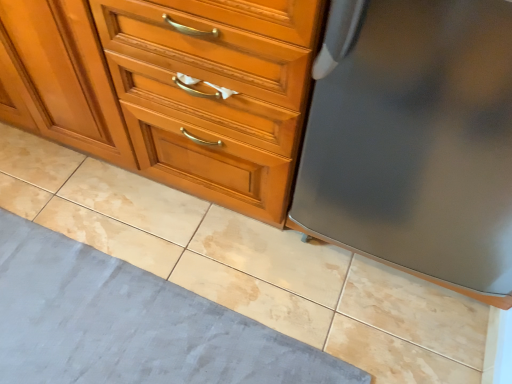
Locate an element on the screen. This screenshot has width=512, height=384. unoccupied area behind gray fabric bath mat at lower left is located at coordinates (144, 226).